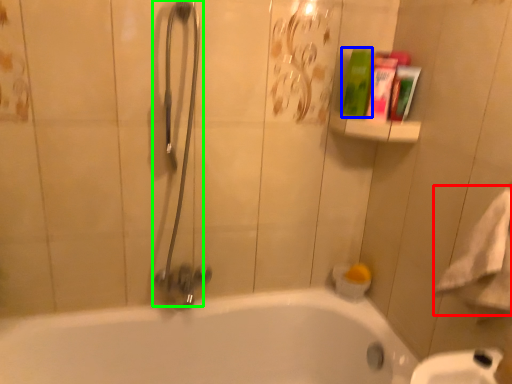
Question: Which is farther away from bath towel (highlighted by a red box)? cleaning product (highlighted by a blue box) or shower (highlighted by a green box)?

Choices:
 (A) cleaning product
 (B) shower

Answer: (B)